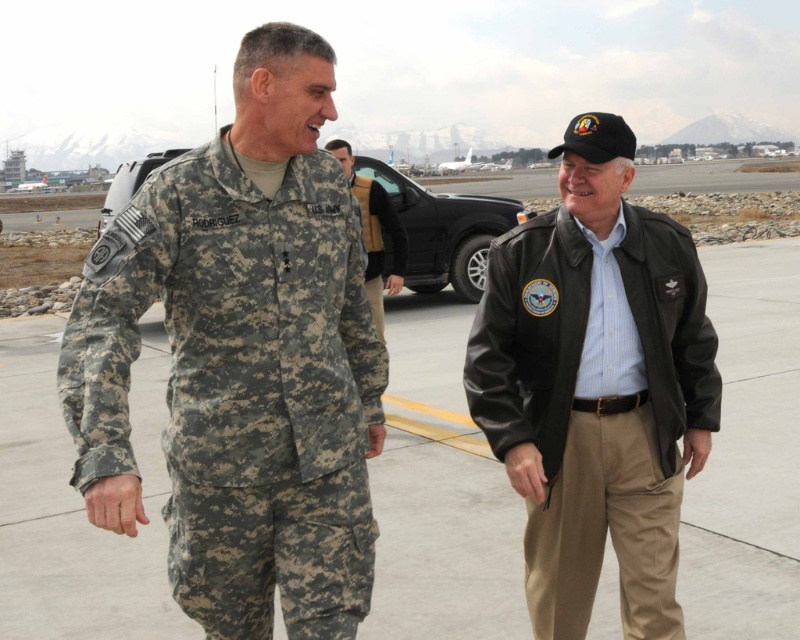
Does camouflage uniform at left appear on the left side of camouflage fabric uniform at center?

In fact, camouflage uniform at left is to the right of camouflage fabric uniform at center.

Does point (168, 632) come closer to viewer compared to point (377, 269)?

Yes, point (168, 632) is in front of point (377, 269).

The width and height of the screenshot is (800, 640). What do you see at coordinates (440, 496) in the screenshot?
I see `camouflage uniform at left` at bounding box center [440, 496].

You are a GUI agent. You are given a task and a screenshot of the screen. Output one action in this format:
    pyautogui.click(x=<x>, y=<y>)
    Task: Click on the camouflage uniform at left
    The width and height of the screenshot is (800, 640).
    Given the screenshot: What is the action you would take?
    click(440, 496)

Does camouflage fabric uniform at left appear over camouflage fabric uniform at center?

No, camouflage fabric uniform at left is not above camouflage fabric uniform at center.

Is camouflage fabric uniform at left positioned at the back of camouflage fabric uniform at center?

No, it is not.

Where is `camouflage fabric uniform at left`? camouflage fabric uniform at left is located at coordinates (240, 387).

Does point (712, 253) come closer to viewer compared to point (170, 538)?

No, (712, 253) is behind (170, 538).

Is point (736, 499) positioned after point (337, 305)?

Yes, point (736, 499) is behind point (337, 305).

This screenshot has width=800, height=640. I want to click on camouflage uniform at left, so click(440, 496).